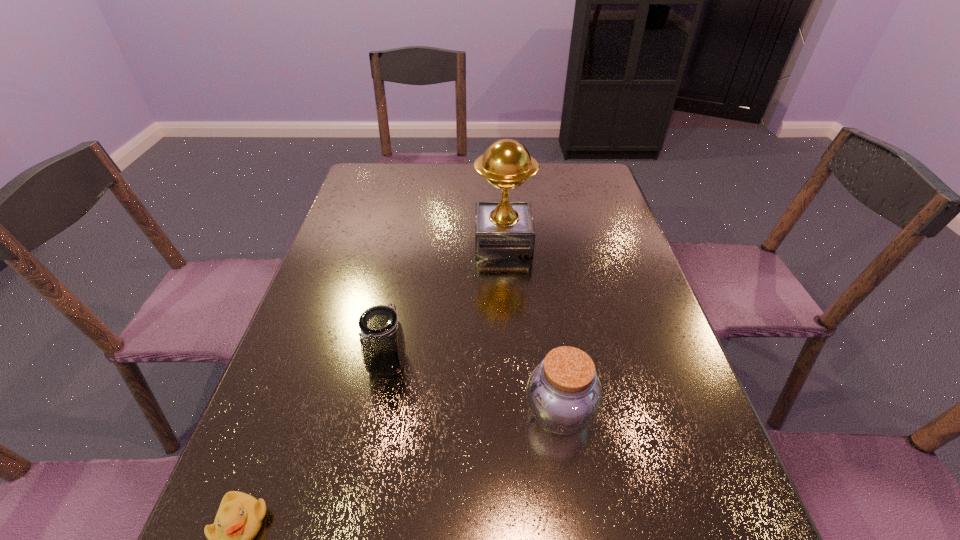
Locate an element on the screen. the tallest object is located at coordinates (504, 229).

In order to click on award in this screenshot , I will do `click(504, 229)`.

The image size is (960, 540). I want to click on the second nearest object, so click(564, 395).

You are a GUI agent. You are given a task and a screenshot of the screen. Output one action in this format:
    pyautogui.click(x=<x>, y=<y>)
    Task: Click on the nearer jar
    Image resolution: width=960 pixels, height=540 pixels.
    Given the screenshot: What is the action you would take?
    pyautogui.click(x=564, y=395)

Where is `the second farthest object`? The height and width of the screenshot is (540, 960). the second farthest object is located at coordinates (382, 340).

This screenshot has width=960, height=540. Find the location of `the third object from right to left`. the third object from right to left is located at coordinates (382, 340).

Where is `vacant space situated on the front-facing side of the farthest object`? vacant space situated on the front-facing side of the farthest object is located at coordinates (429, 241).

Locate an element on the screen. This screenshot has height=540, width=960. free space located 0.100m on the front-facing side of the farthest object is located at coordinates (440, 241).

This screenshot has width=960, height=540. In order to click on vacant space located 0.370m on the front-facing side of the farthest object in this screenshot , I will do 346,241.

The image size is (960, 540). Find the location of `vacant position located on the left of the nearer jar`. vacant position located on the left of the nearer jar is located at coordinates (375, 413).